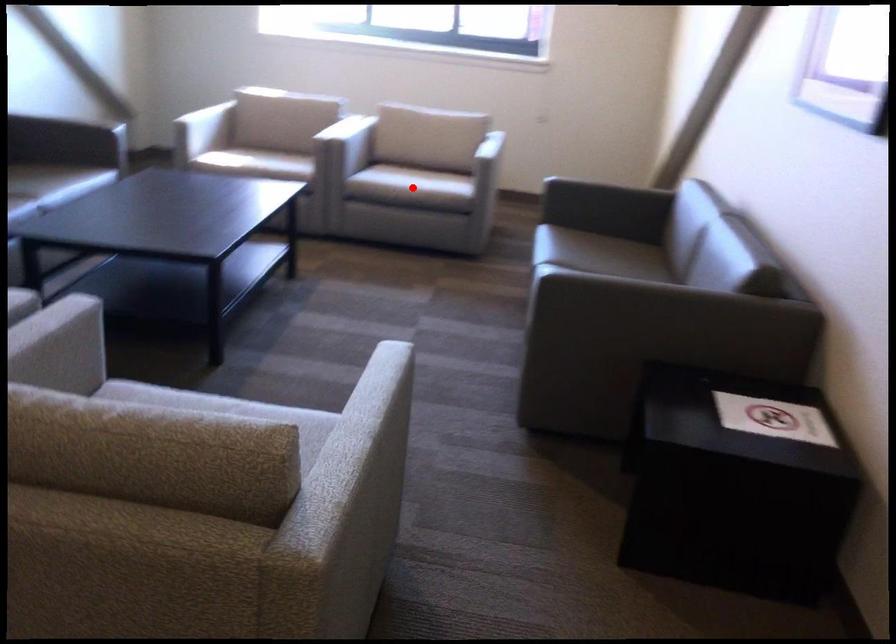
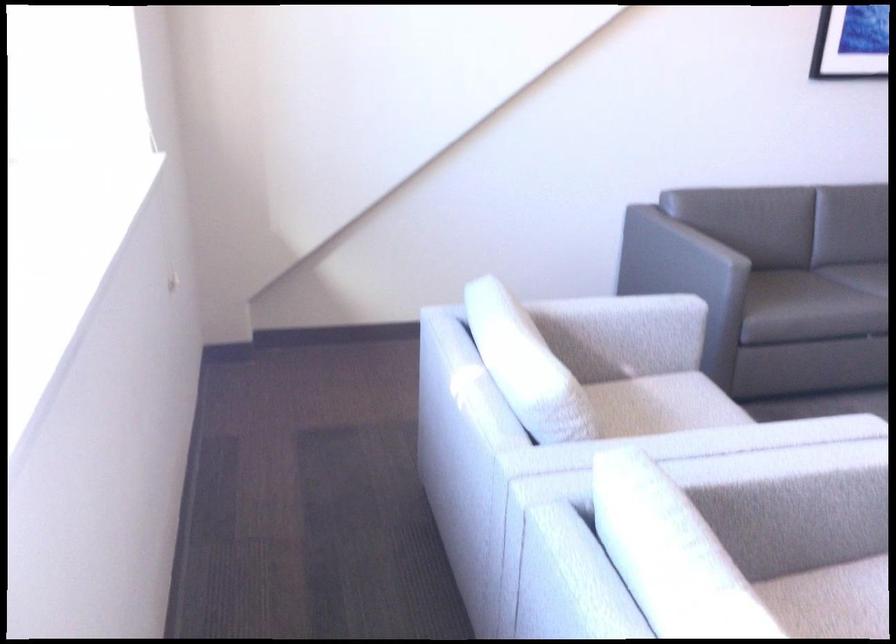
Question: I am providing you with two images of the same scene from different viewpoints. A red point is marked on the first image. Is the red point's position out of view in image 2?

Choices:
 (A) Yes
 (B) No

Answer: (A)